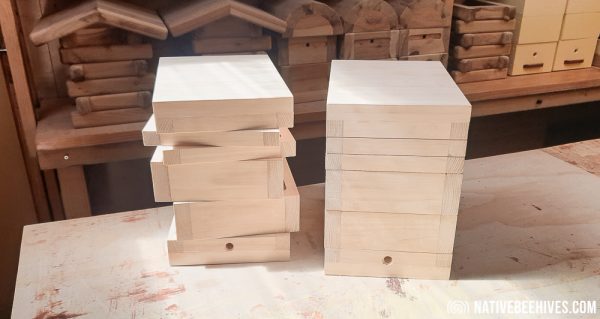
Locate an element on the screen. This screenshot has width=600, height=319. table is located at coordinates (325, 290), (93, 142).